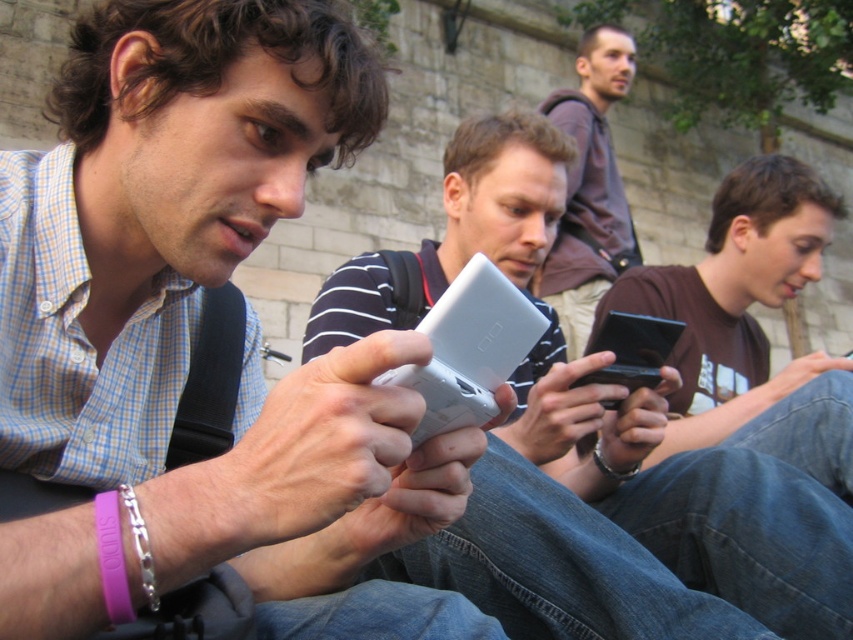
Question: Can you confirm if matte white phone at center is positioned to the left of silver plastic phone at center?

Choices:
 (A) no
 (B) yes

Answer: (B)

Question: Which point appears closest to the camera in this image?

Choices:
 (A) (442, 362)
 (B) (721, 220)
 (C) (625, 378)
 (D) (178, 579)

Answer: (D)

Question: Can you confirm if matte black phone at center is positioned to the right of black glossy smartphone at center?

Choices:
 (A) yes
 (B) no

Answer: (A)

Question: Among these objects, which one is farthest from the camera?

Choices:
 (A) matte black phone at center
 (B) black glossy smartphone at center
 (C) silver plastic phone at center

Answer: (A)

Question: Among these objects, which one is farthest from the camera?

Choices:
 (A) black glossy smartphone at center
 (B) white matte smartphone at center

Answer: (A)

Question: Does matte black phone at center appear on the right side of white matte smartphone at center?

Choices:
 (A) no
 (B) yes

Answer: (B)